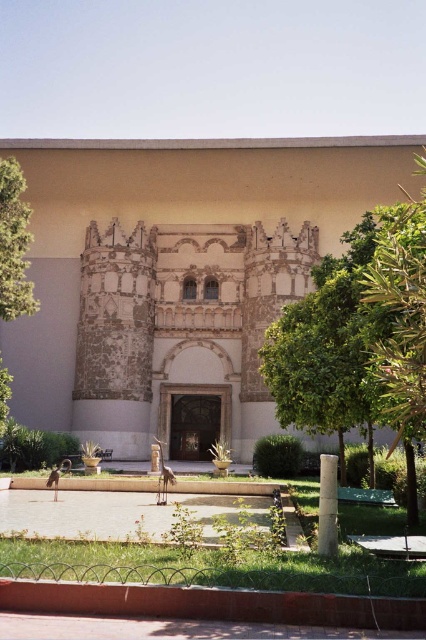
Question: Does stone mosaic palace at center appear on the left side of green leafy tree at center?

Choices:
 (A) no
 (B) yes

Answer: (B)

Question: Can you confirm if stone mosaic palace at center is smaller than green leafy tree at right?

Choices:
 (A) yes
 (B) no

Answer: (B)

Question: Which point appears closest to the camera in this image?

Choices:
 (A) (412, 225)
 (B) (22, 200)
 (C) (402, 228)
 (D) (74, 323)

Answer: (A)

Question: Which object is farther from the camera taking this photo?

Choices:
 (A) green leafy tree at center
 (B) green leafy tree at right
 (C) green leafy tree at left
 (D) stone mosaic palace at center

Answer: (D)

Question: Which of the following is the farthest from the observer?

Choices:
 (A) (16, 195)
 (B) (377, 362)

Answer: (A)

Question: Is green leafy tree at center wider than green leafy tree at right?

Choices:
 (A) yes
 (B) no

Answer: (B)